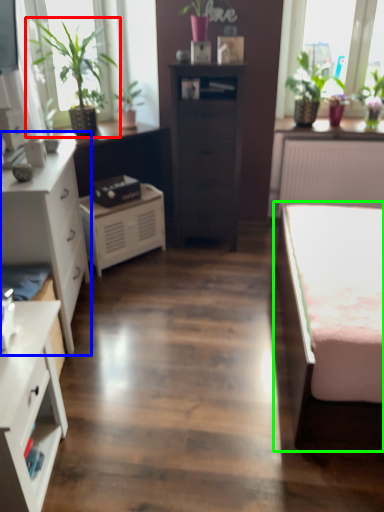
Question: Based on their relative distances, which object is farther from houseplant (highlighted by a red box)? Choose from chest of drawers (highlighted by a blue box) and bed (highlighted by a green box).

Choices:
 (A) chest of drawers
 (B) bed

Answer: (B)